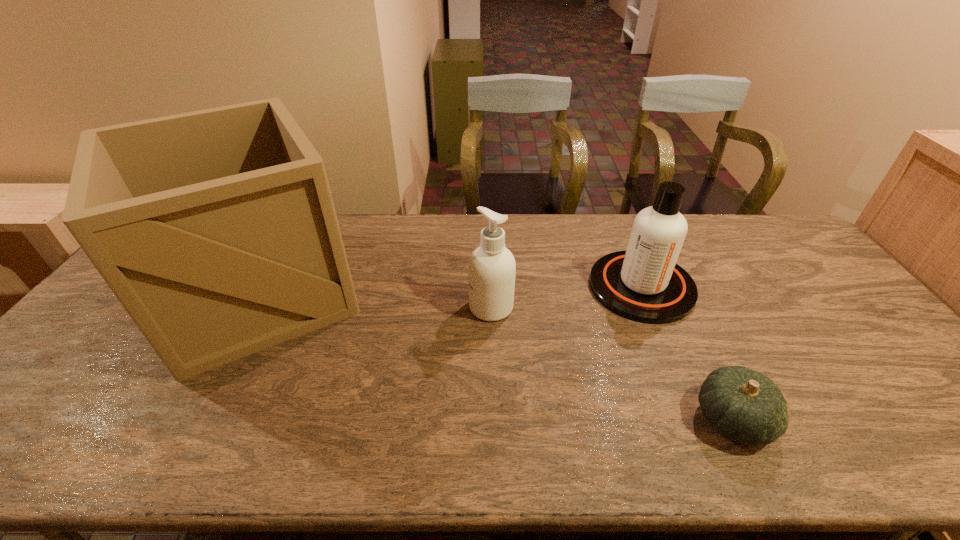
The image size is (960, 540). Find the location of `empty location between the right cleansing agent and the left cleansing agent`. empty location between the right cleansing agent and the left cleansing agent is located at coordinates (566, 297).

At what (x,y) coordinates should I click in order to perform the action: click on the third closest object to the right cleansing agent. Please return your answer as a coordinate pair (x, y). The image size is (960, 540). Looking at the image, I should click on coord(216,230).

Locate which object is the second closest to the gourd. Please provide its 2D coordinates. Your answer should be formatted as a tuple, i.e. [(x, y)], where the tuple contains the x and y coordinates of a point satisfying the conditions above.

[(491, 270)]

I want to click on vacant space that satisfies the following two spatial constraints: 1. on the front side of the right cleansing agent; 2. on the front label of the second object from left to right, so click(650, 307).

Find the location of a particular element. The width and height of the screenshot is (960, 540). free region that satisfies the following two spatial constraints: 1. on the front label of the nearest object; 2. on the left side of the left cleansing agent is located at coordinates (494, 419).

I want to click on free spot that satisfies the following two spatial constraints: 1. on the front label of the nearest object; 2. on the right side of the second object from left to right, so click(x=494, y=419).

Locate an element on the screen. The height and width of the screenshot is (540, 960). vacant area that satisfies the following two spatial constraints: 1. on the front label of the left cleansing agent; 2. on the right side of the nearest object is located at coordinates (494, 419).

The width and height of the screenshot is (960, 540). What are the coordinates of `vacant space that satisfies the following two spatial constraints: 1. on the front label of the nearest object; 2. on the right side of the second object from left to right` in the screenshot? It's located at (494, 419).